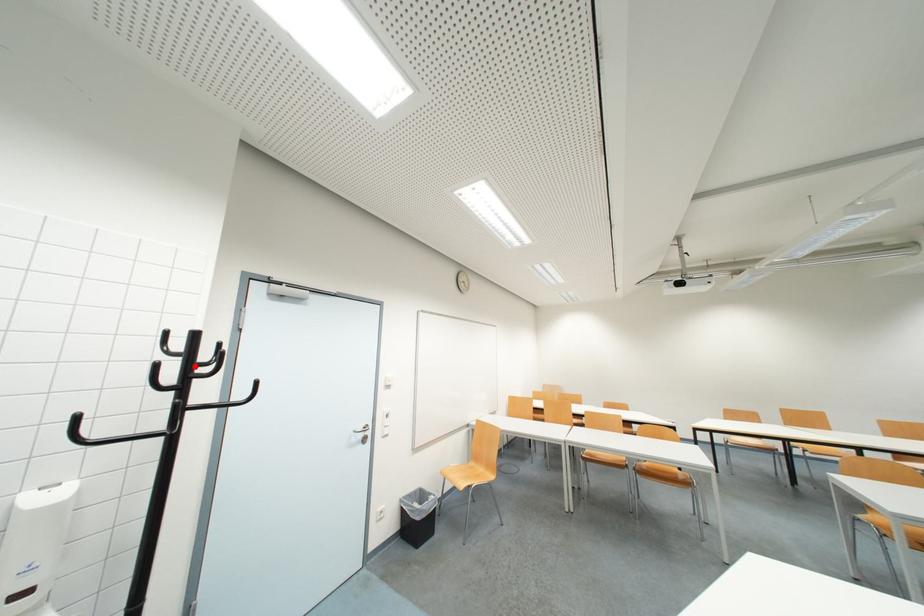
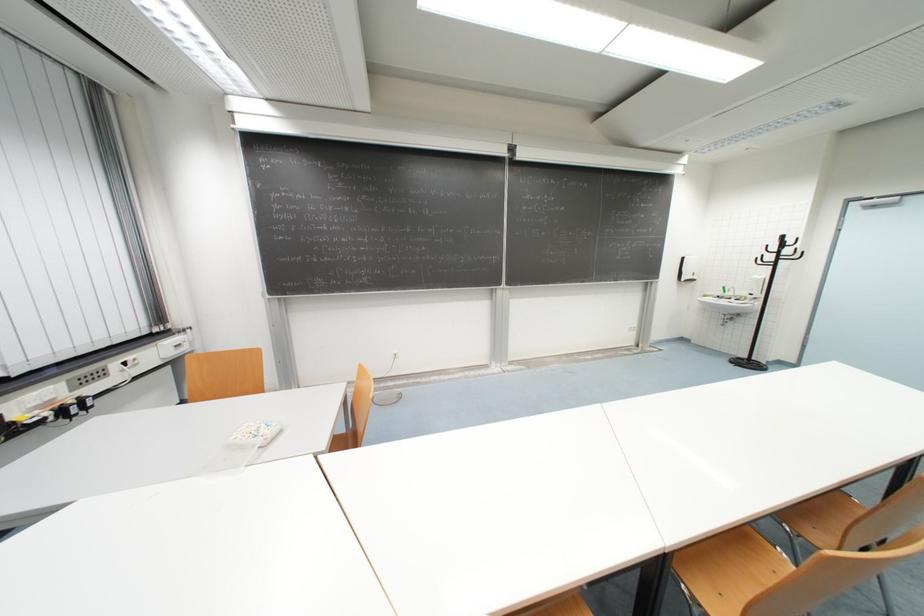
Find the pixel in the second image that matches the highlighted location in the first image.

(785, 246)